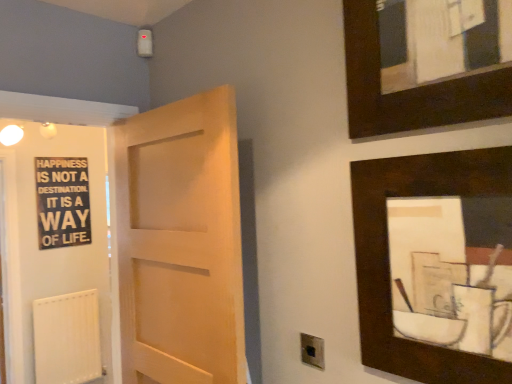
Image resolution: width=512 pixels, height=384 pixels. Describe the element at coordinates (312, 351) in the screenshot. I see `metallic silver electric outlet at lower center` at that location.

The width and height of the screenshot is (512, 384). Describe the element at coordinates (180, 243) in the screenshot. I see `light wood door at center` at that location.

I want to click on black matte signboard at left, so click(x=50, y=249).

Identify the location of metallic silver electric outlet at lower center. This screenshot has width=512, height=384. (312, 351).

Is black matte signboard at left completely or partially outside of black wood signboard at left?

black matte signboard at left lies outside black wood signboard at left's area.

What's the angular difference between black matte signboard at left and black wood signboard at left's facing directions?

They differ by 1.23 degrees in their facing directions.

Who is smaller, black matte signboard at left or black wood signboard at left?

black wood signboard at left.

Is black matte signboard at left facing away from black wood signboard at left?

black matte signboard at left is not turned away from black wood signboard at left.

Between black matte signboard at left and dark wood picture frame at upper right, which appears as the first picture frame when ordered from the bottom, which one has larger size?

Bigger between the two is black matte signboard at left.

Can you confirm if black matte signboard at left is shorter than dark wood picture frame at upper right, which appears as the first picture frame when ordered from the bottom?

Incorrect, the height of black matte signboard at left does not fall short of that of dark wood picture frame at upper right, which appears as the first picture frame when ordered from the bottom.

Is black matte signboard at left further to camera compared to dark wood picture frame at upper right, which appears as the first picture frame when ordered from the bottom?

Yes.

In the scene shown: Would you say white matte radiator at lower left is a long distance from dark wood picture frame at upper right, which appears as the first picture frame when ordered from the bottom?

Yes.

Which of these two, white matte radiator at lower left or dark wood picture frame at upper right, which is counted as the 2th picture frame, starting from the top, is smaller?

Smaller between the two is dark wood picture frame at upper right, which is counted as the 2th picture frame, starting from the top.

Considering the sizes of white matte radiator at lower left and dark wood picture frame at upper right, which is counted as the 2th picture frame, starting from the top, in the image, is white matte radiator at lower left taller or shorter than dark wood picture frame at upper right, which is counted as the 2th picture frame, starting from the top,?

In the image, white matte radiator at lower left appears to be taller than dark wood picture frame at upper right, which is counted as the 2th picture frame, starting from the top.

Would you say white matte radiator at lower left is to the left or to the right of dark wood picture frame at upper right, which is counted as the 2th picture frame, starting from the top, in the picture?

In the image, white matte radiator at lower left appears on the left side of dark wood picture frame at upper right, which is counted as the 2th picture frame, starting from the top.

Is metallic silver electric outlet at lower center a part of black wood signboard at left?

That's incorrect, metallic silver electric outlet at lower center is not inside black wood signboard at left.

From a real-world perspective, relative to metallic silver electric outlet at lower center, is black wood signboard at left vertically above or below?

In terms of real-world spatial position, black wood signboard at left is above metallic silver electric outlet at lower center.

Between black wood signboard at left and metallic silver electric outlet at lower center, which one is positioned in front?

metallic silver electric outlet at lower center is more forward.

Which object is wider, black wood signboard at left or metallic silver electric outlet at lower center?

black wood signboard at left is wider.

Looking at this image, is black wood signboard at left oriented away from light wood door at center?

No, black wood signboard at left is not facing away from light wood door at center.

Between black wood signboard at left and light wood door at center, which one has more height?

light wood door at center.

From a real-world perspective, is black wood signboard at left below light wood door at center?

No, from a real-world perspective, black wood signboard at left is not below light wood door at center.

Does white matte radiator at lower left have a greater width compared to metallic silver electric outlet at lower center?

Yes.

Is white matte radiator at lower left positioned far away from metallic silver electric outlet at lower center?

white matte radiator at lower left is positioned a significant distance from metallic silver electric outlet at lower center.

Considering the relative sizes of white matte radiator at lower left and metallic silver electric outlet at lower center in the image provided, is white matte radiator at lower left bigger than metallic silver electric outlet at lower center?

Yes.

Is white matte radiator at lower left at the right side of metallic silver electric outlet at lower center?

Incorrect, white matte radiator at lower left is not on the right side of metallic silver electric outlet at lower center.

In the image, is white matte radiator at lower left positioned in front of or behind dark wood picture frame at upper right, marked as the first picture frame in a top-to-bottom arrangement?

Visually, white matte radiator at lower left is located behind dark wood picture frame at upper right, marked as the first picture frame in a top-to-bottom arrangement.

Does point (80, 344) appear closer or farther from the camera than point (474, 98)?

Point (80, 344) is farther from the camera than point (474, 98).

Looking at the image, does white matte radiator at lower left seem bigger or smaller compared to dark wood picture frame at upper right, marked as the first picture frame in a top-to-bottom arrangement?

white matte radiator at lower left is bigger than dark wood picture frame at upper right, marked as the first picture frame in a top-to-bottom arrangement.

The height and width of the screenshot is (384, 512). Find the location of `the 2nd picture frame in front of the white matte radiator at lower left`. the 2nd picture frame in front of the white matte radiator at lower left is located at coordinates (409, 90).

You are a GUI agent. You are given a task and a screenshot of the screen. Output one action in this format:
    pyautogui.click(x=<x>, y=<y>)
    Task: Click on the elevator on the right side of black wood signboard at left
    Image resolution: width=512 pixels, height=384 pixels.
    Given the screenshot: What is the action you would take?
    pyautogui.click(x=50, y=249)

This screenshot has width=512, height=384. I want to click on elevator beneath the dark wood picture frame at upper right, which is counted as the 2th picture frame, starting from the top (from a real-world perspective), so click(50, 249).

Considering their positions, is dark wood picture frame at upper right, positioned as the 2th picture frame in bottom-to-top order, positioned further to dark wood picture frame at upper right, which is counted as the 2th picture frame, starting from the top, than metallic silver electric outlet at lower center?

metallic silver electric outlet at lower center.

From the picture: Which object lies further to the anchor point light wood door at center, dark wood picture frame at upper right, which appears as the first picture frame when ordered from the bottom, or metallic silver electric outlet at lower center?

dark wood picture frame at upper right, which appears as the first picture frame when ordered from the bottom, is further to light wood door at center.

When comparing their distances from dark wood picture frame at upper right, marked as the first picture frame in a top-to-bottom arrangement, does black wood signboard at left or black matte signboard at left seem further?

black matte signboard at left.

Based on their spatial positions, is black matte signboard at left or dark wood picture frame at upper right, which is counted as the 2th picture frame, starting from the top, further from light wood door at center?

black matte signboard at left is further to light wood door at center.

From the image, which object appears to be nearer to dark wood picture frame at upper right, marked as the first picture frame in a top-to-bottom arrangement, white matte radiator at lower left or black wood signboard at left?

black wood signboard at left.

Looking at the image, which one is located further to dark wood picture frame at upper right, positioned as the 2th picture frame in bottom-to-top order, black wood signboard at left or metallic silver electric outlet at lower center?

black wood signboard at left is positioned further to the anchor dark wood picture frame at upper right, positioned as the 2th picture frame in bottom-to-top order.

Based on their spatial positions, is light wood door at center or dark wood picture frame at upper right, which is counted as the 2th picture frame, starting from the top, closer to white matte radiator at lower left?

Based on the image, light wood door at center appears to be nearer to white matte radiator at lower left.

When comparing their distances from black matte signboard at left, does dark wood picture frame at upper right, positioned as the 2th picture frame in bottom-to-top order, or metallic silver electric outlet at lower center seem closer?

Based on the image, metallic silver electric outlet at lower center appears to be nearer to black matte signboard at left.

Find the location of a particular element. This screenshot has width=512, height=384. elevator located between dark wood picture frame at upper right, marked as the first picture frame in a top-to-bottom arrangement, and white matte radiator at lower left in the depth direction is located at coordinates (50, 249).

What are the coordinates of `electric outlet located between dark wood picture frame at upper right, which appears as the first picture frame when ordered from the bottom, and white matte radiator at lower left in the depth direction` in the screenshot? It's located at (312, 351).

This screenshot has height=384, width=512. In order to click on elevator positioned between dark wood picture frame at upper right, which is counted as the 2th picture frame, starting from the top, and white matte radiator at lower left from near to far in this screenshot , I will do `click(50, 249)`.

Identify the location of elevator between dark wood picture frame at upper right, which is counted as the 2th picture frame, starting from the top, and black wood signboard at left, along the z-axis. Image resolution: width=512 pixels, height=384 pixels. (50, 249).